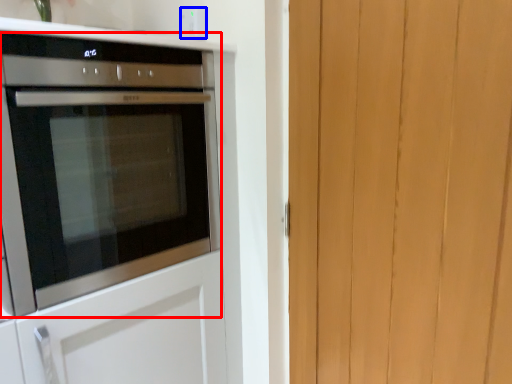
Question: Which object appears farthest to the camera in this image, oven (highlighted by a red box) or electric outlet (highlighted by a blue box)?

Choices:
 (A) oven
 (B) electric outlet

Answer: (B)